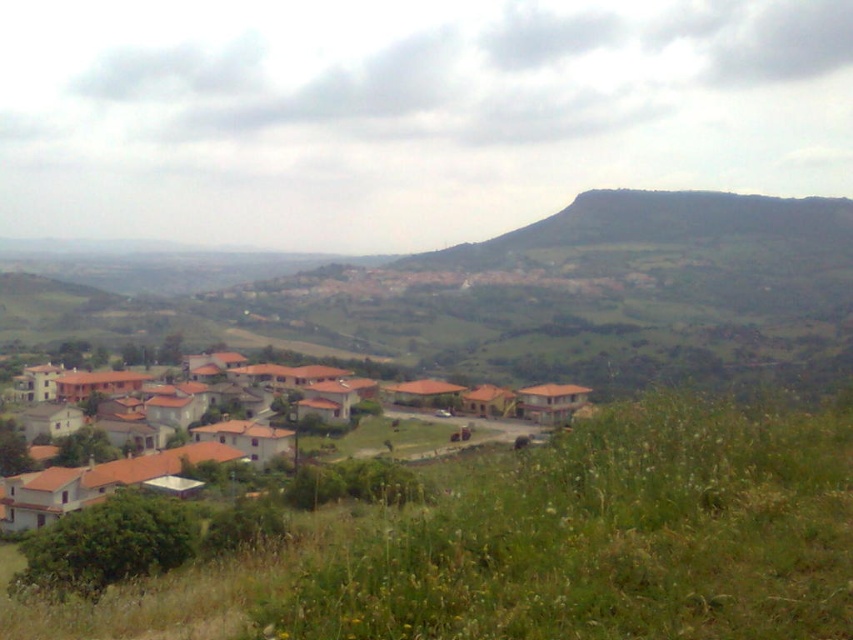
Question: Estimate the real-world distances between objects in this image. Which object is farther from the brown clay houses at center?

Choices:
 (A) green grassy hill at upper center
 (B) green grassy at lower center

Answer: (A)

Question: Is green grassy at lower center thinner than green grassy hill at upper center?

Choices:
 (A) no
 (B) yes

Answer: (B)

Question: Which object is closer to the camera taking this photo?

Choices:
 (A) green grassy at lower center
 (B) green grassy hill at upper center

Answer: (A)

Question: Is green grassy hill at upper center further to camera compared to brown clay houses at center?

Choices:
 (A) no
 (B) yes

Answer: (B)

Question: Is green grassy at lower center to the left of brown clay houses at center from the viewer's perspective?

Choices:
 (A) yes
 (B) no

Answer: (B)

Question: Estimate the real-world distances between objects in this image. Which object is closer to the green grassy hill at upper center?

Choices:
 (A) green grassy at lower center
 (B) brown clay houses at center

Answer: (B)